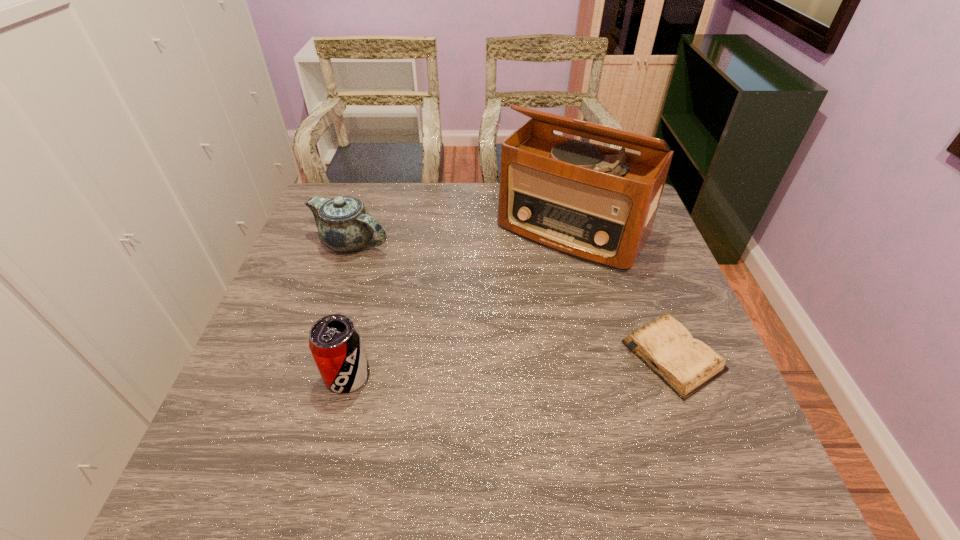
I want to click on soda can, so click(x=335, y=342).

Where is `the shortest object`? This screenshot has width=960, height=540. the shortest object is located at coordinates (686, 364).

The height and width of the screenshot is (540, 960). Identify the location of radio receiver. (595, 203).

What are the coordinates of `chinaware` in the screenshot? It's located at (344, 225).

Where is `free space located on the right of the soda can`? The image size is (960, 540). free space located on the right of the soda can is located at coordinates (540, 376).

At what (x,y) coordinates should I click in order to perform the action: click on vacant space situated on the back of the diary. Please return your answer as a coordinate pair (x, y). Image resolution: width=960 pixels, height=540 pixels. Looking at the image, I should click on (623, 226).

Identify the location of free space located on the front panel of the tallest object. click(x=469, y=359).

Image resolution: width=960 pixels, height=540 pixels. What are the coordinates of `free space located on the front panel of the tallest object` in the screenshot? It's located at (484, 341).

Where is `free space located on the front panel of the tallest object`? The height and width of the screenshot is (540, 960). free space located on the front panel of the tallest object is located at coordinates (520, 291).

Locate an element on the screen. The image size is (960, 540). vacant point located from the spout of the chinaware is located at coordinates (443, 307).